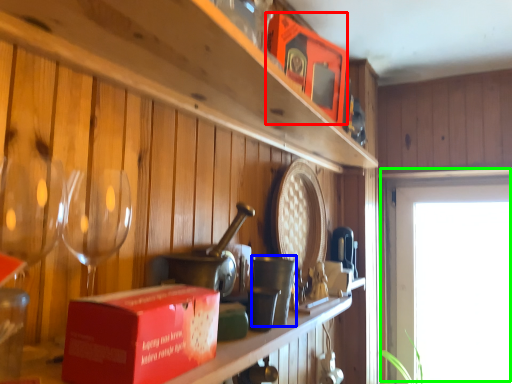
Question: Estimate the real-world distances between objects in this image. Which object is closer to box (highlighted by a red box), tableware (highlighted by a blue box) or window (highlighted by a green box)?

Choices:
 (A) tableware
 (B) window

Answer: (A)